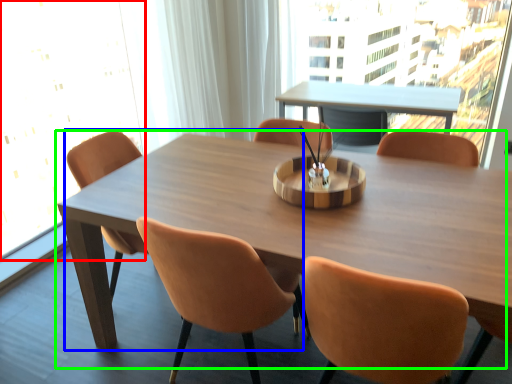
Question: Considering the real-world distances, which object is closest to window screen (highlighted by a red box)? chair (highlighted by a blue box) or table (highlighted by a green box).

Choices:
 (A) chair
 (B) table

Answer: (A)